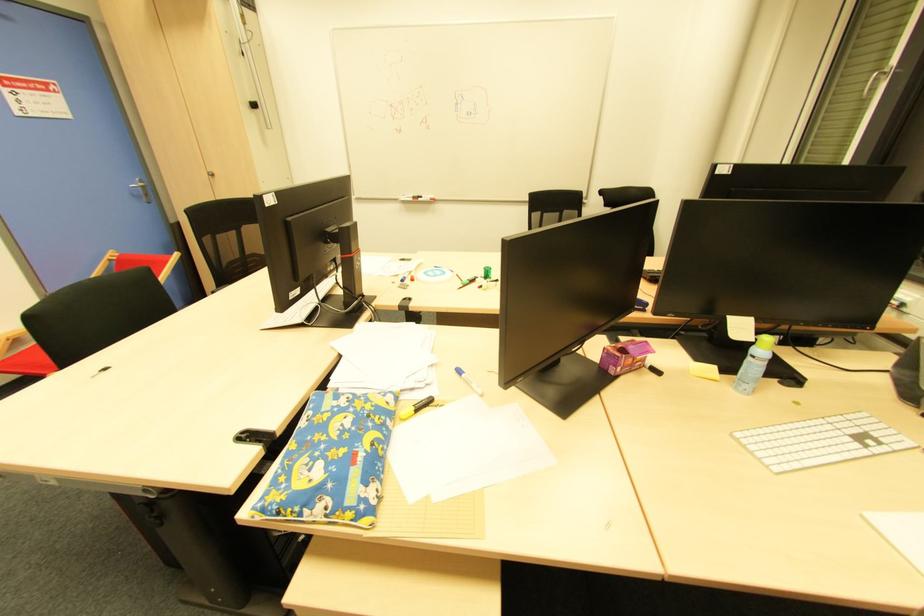
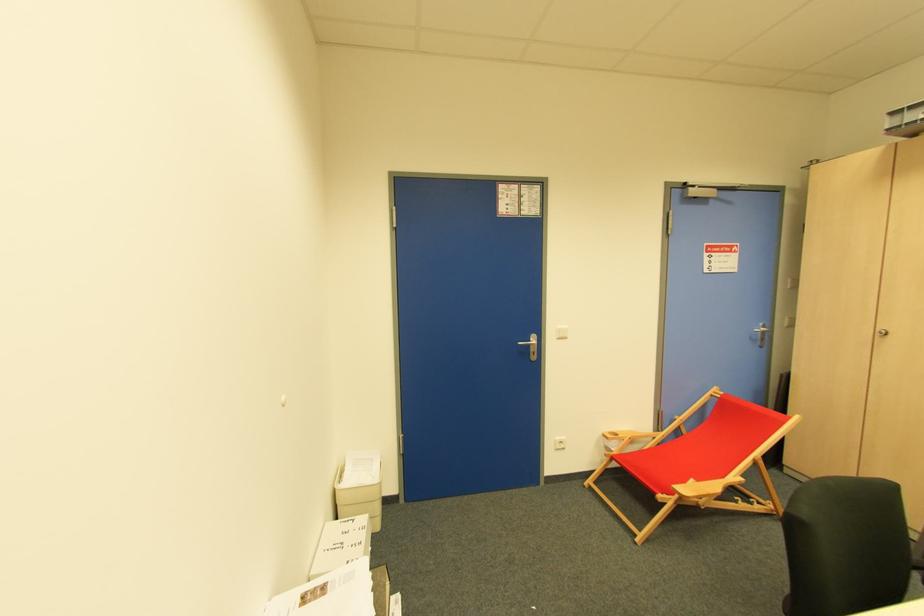
Where in the second image is the point corresponding to point (143, 188) from the first image?

(763, 333)